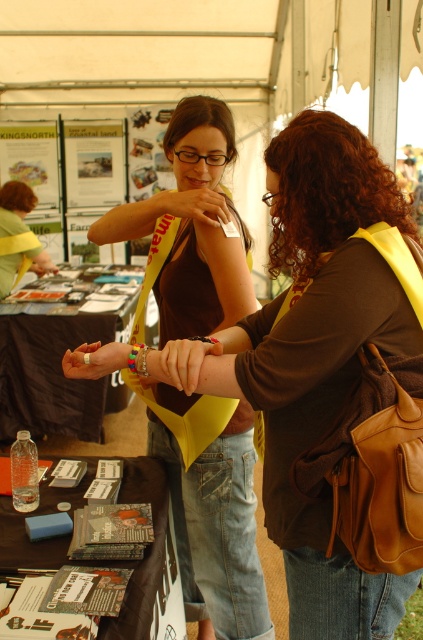
Question: Estimate the real-world distances between objects in this image. Which object is farther from the matte yellow vest at center?

Choices:
 (A) yellow fabric sash at center
 (B) matte plastic wristband at center

Answer: (A)

Question: Is brown matte vest at center thinner than yellow fabric sash at center?

Choices:
 (A) yes
 (B) no

Answer: (A)

Question: Estimate the real-world distances between objects in this image. Which object is closer to the matte yellow vest at center?

Choices:
 (A) matte plastic cards at center
 (B) brown leather purse at center
 (C) brown matte vest at center

Answer: (A)

Question: Estimate the real-world distances between objects in this image. Which object is farther from the yellow fabric sash at center?

Choices:
 (A) matte plastic cards at center
 (B) brown matte vest at center
 (C) brown leather purse at center
 (D) matte plastic wristband at center

Answer: (D)

Question: Is matte plastic wristband at center bigger than matte yellow vest at center?

Choices:
 (A) yes
 (B) no

Answer: (A)

Question: Can you confirm if brown matte vest at center is smaller than brown leather purse at center?

Choices:
 (A) yes
 (B) no

Answer: (B)